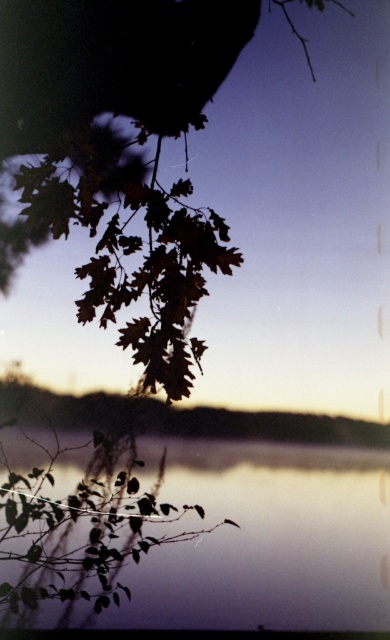
Between brown leafy branch at upper left and silvery reflective water at bottom center, which one appears on the left side from the viewer's perspective?

From the viewer's perspective, brown leafy branch at upper left appears more on the left side.

The height and width of the screenshot is (640, 390). In order to click on brown leafy branch at upper left in this screenshot , I will do `click(118, 154)`.

Between point (132, 104) and point (377, 602), which one is positioned in front?

Positioned in front is point (377, 602).

Where is `brown leafy branch at upper left`? The width and height of the screenshot is (390, 640). brown leafy branch at upper left is located at coordinates (118, 154).